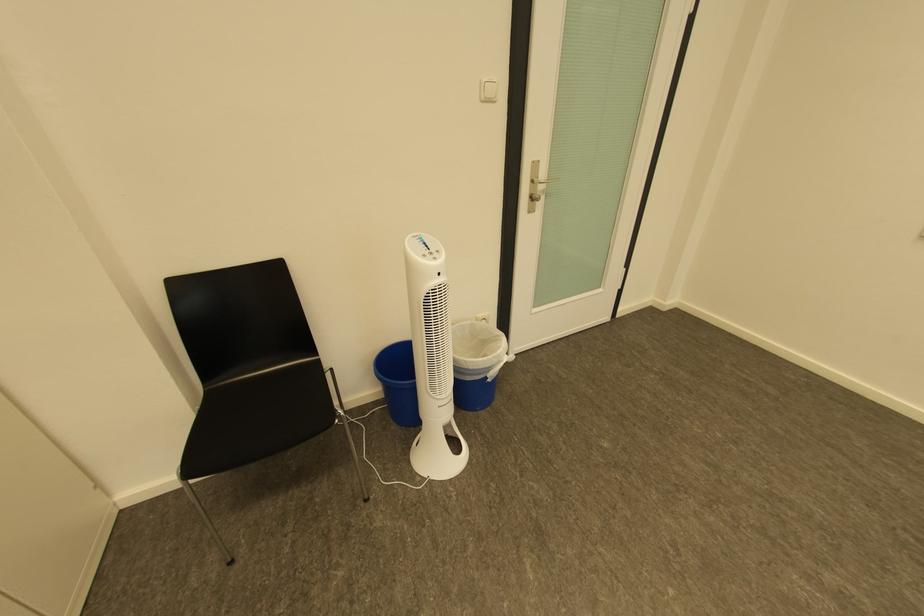
Where would you push the fan control buttons? Please return your answer as a coordinate pair (x, y).

(432, 257)